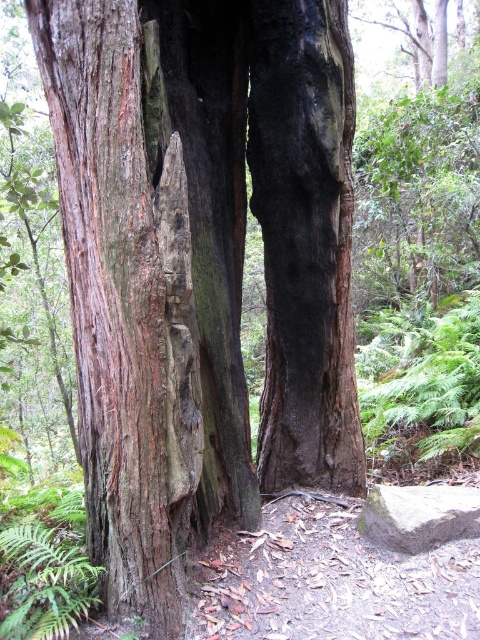
Which is more to the right, rough bark tree trunk at center or gray smooth rock at lower right?

From the viewer's perspective, gray smooth rock at lower right appears more on the right side.

Who is more distant from viewer, (141, 380) or (440, 492)?

Point (440, 492)

Identify the location of rough bark tree trunk at center. (126, 301).